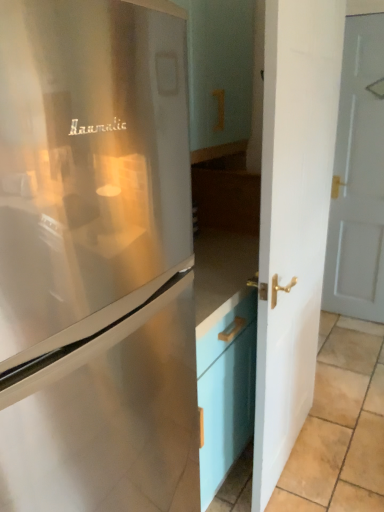
I want to click on free space above beige tile at lower right (from a real-world perspective), so click(346, 367).